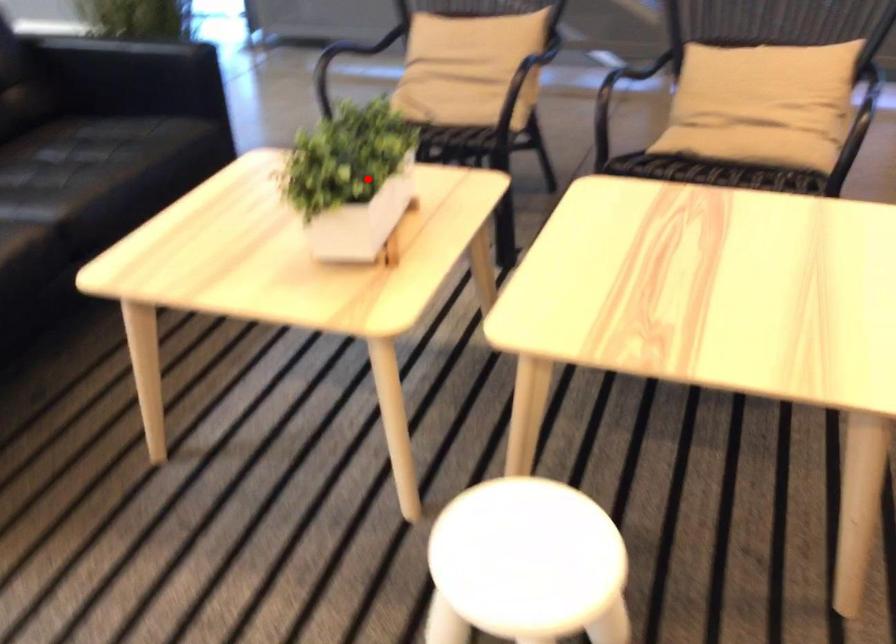
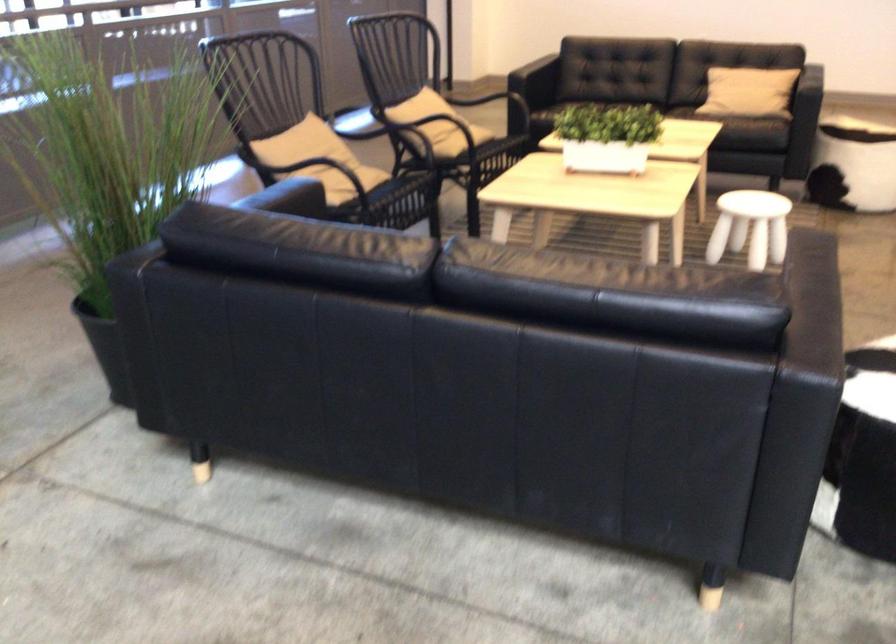
Where in the second image is the point corresponding to the highlighted location from the first image?

(607, 137)